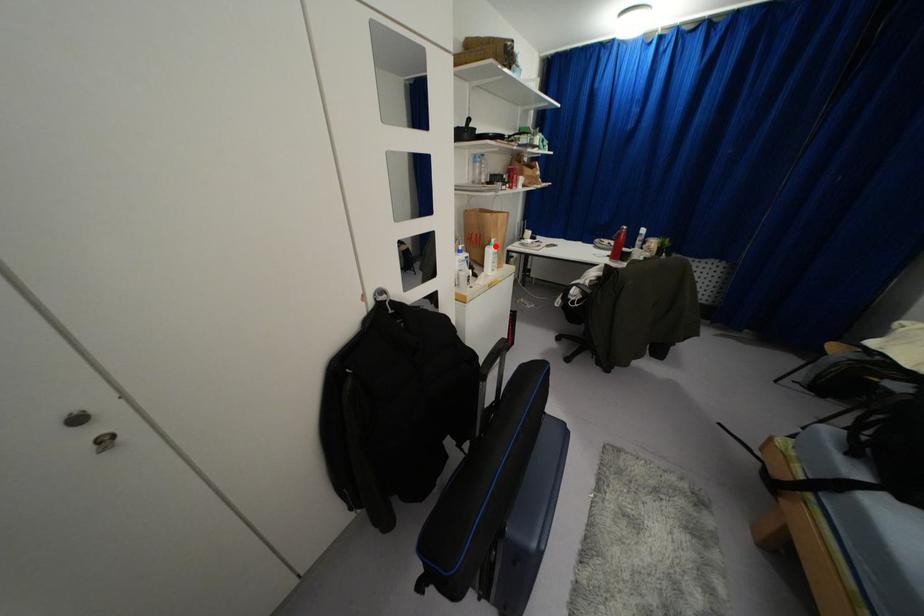
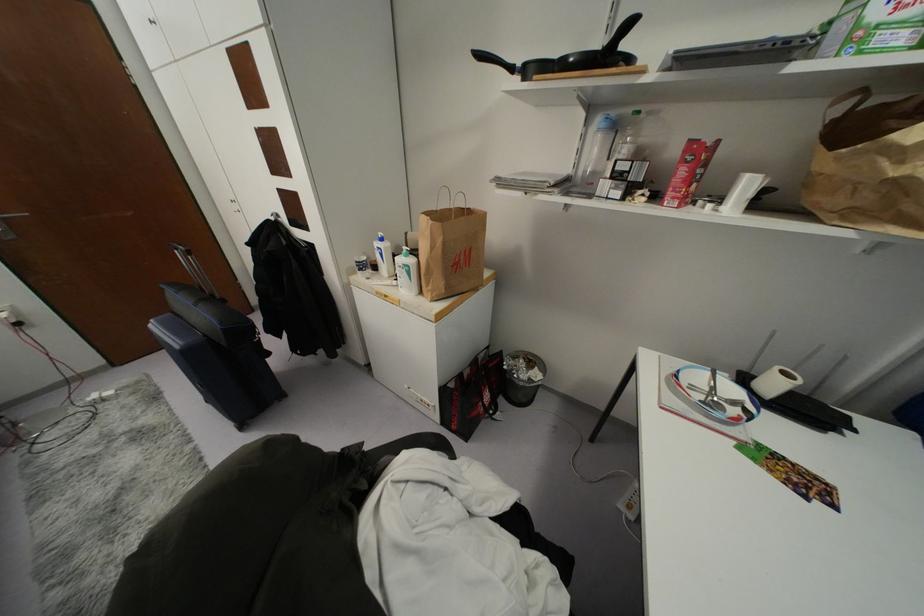
Question: I am providing you with two images of the same scene from different viewpoints. A red point is marked on the first image. At the location where the point appears in image 1, is it still visible in image 2?

Choices:
 (A) Yes
 (B) No

Answer: (A)